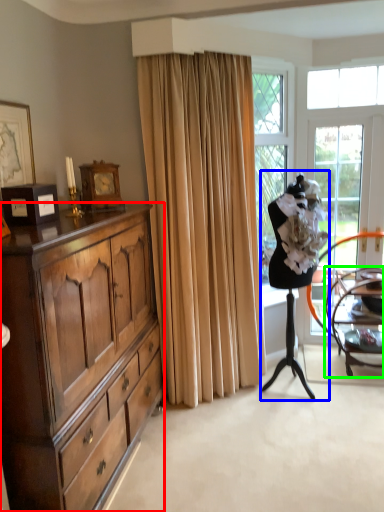
Question: Which object is positioned farthest from cabinetry (highlighted by a red box)? Select from ballet dancer (highlighted by a blue box) and chair (highlighted by a green box).

Choices:
 (A) ballet dancer
 (B) chair

Answer: (B)